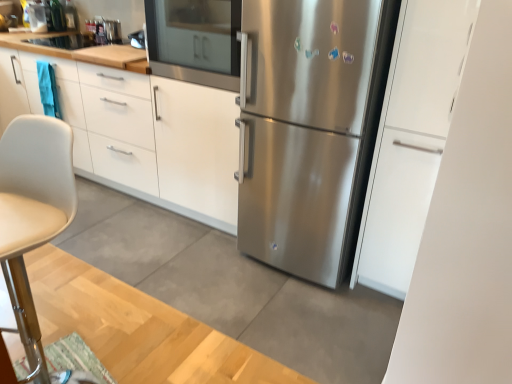
Question: Is satin white cabinet at right, which is the second cabinetry in left-to-right order, bigger than stainless steel oven at center?

Choices:
 (A) no
 (B) yes

Answer: (B)

Question: Does satin white cabinet at right, which is the second cabinetry in left-to-right order, lie in front of stainless steel oven at center?

Choices:
 (A) yes
 (B) no

Answer: (A)

Question: Does satin white cabinet at right, which is counted as the 1th cabinetry, starting from the right, appear on the right side of stainless steel oven at center?

Choices:
 (A) yes
 (B) no

Answer: (A)

Question: From a real-world perspective, is satin white cabinet at right, marked as the second cabinetry in a back-to-front arrangement, physically below stainless steel oven at center?

Choices:
 (A) no
 (B) yes

Answer: (B)

Question: Does satin white cabinet at right, acting as the first cabinetry starting from the front, have a greater width compared to stainless steel oven at center?

Choices:
 (A) no
 (B) yes

Answer: (A)

Question: Does satin white cabinet at right, which is the second cabinetry in left-to-right order, have a smaller size compared to stainless steel oven at center?

Choices:
 (A) no
 (B) yes

Answer: (A)

Question: Is stainless steel oven at center positioned beyond the bounds of white matte cabinet at upper left, the second cabinetry in the right-to-left sequence?

Choices:
 (A) no
 (B) yes

Answer: (B)

Question: Are stainless steel oven at center and white matte cabinet at upper left, which ranks as the 1th cabinetry in left-to-right order, far apart?

Choices:
 (A) no
 (B) yes

Answer: (A)

Question: Is stainless steel oven at center closer to the viewer compared to white matte cabinet at upper left, positioned as the 2th cabinetry in front-to-back order?

Choices:
 (A) yes
 (B) no

Answer: (A)

Question: Is stainless steel oven at center directly adjacent to white matte cabinet at upper left, which ranks as the 1th cabinetry in left-to-right order?

Choices:
 (A) yes
 (B) no

Answer: (B)

Question: Can you confirm if stainless steel oven at center is thinner than white matte cabinet at upper left, marked as the 1th cabinetry in a back-to-front arrangement?

Choices:
 (A) yes
 (B) no

Answer: (A)

Question: Considering the relative positions of stainless steel oven at center and white matte cabinet at upper left, the second cabinetry in the right-to-left sequence, in the image provided, is stainless steel oven at center behind white matte cabinet at upper left, the second cabinetry in the right-to-left sequence,?

Choices:
 (A) yes
 (B) no

Answer: (B)

Question: From a real-world perspective, does beige leather chair at left sit lower than stainless steel oven at center?

Choices:
 (A) yes
 (B) no

Answer: (A)